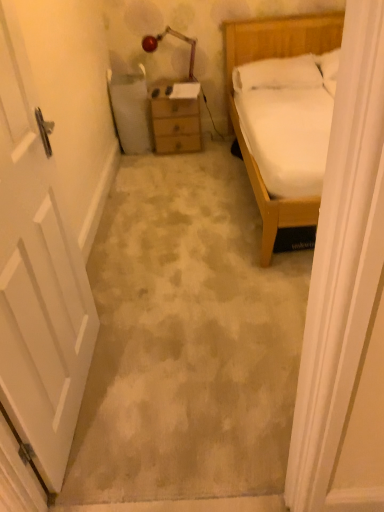
I want to click on free spot above white matte door at left (from a real-world perspective), so click(204, 240).